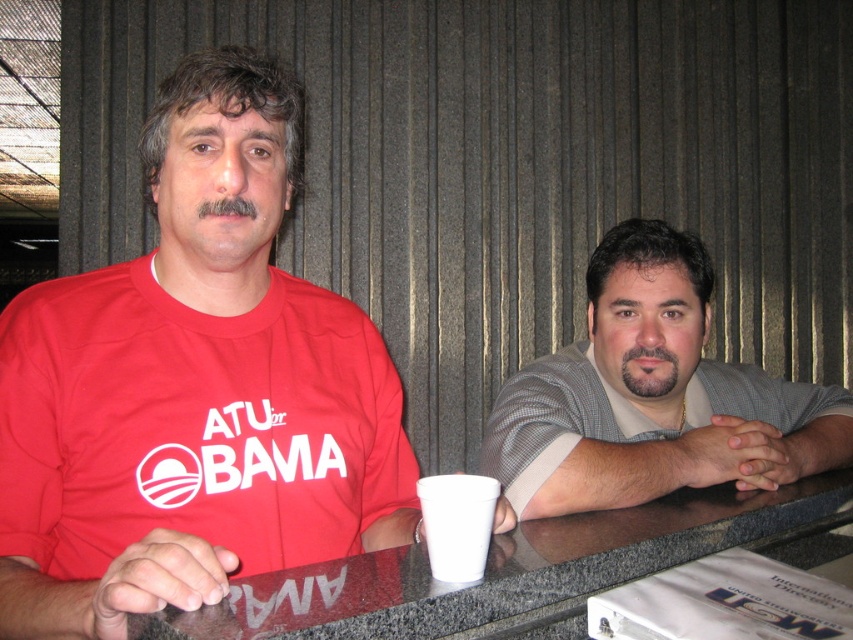
From the picture: You are a photographer standing in front of the scene. You want to take a photo of the gray textured shirt at right and the granite table at center. Which object should you focus on first to ensure it appears sharp in the photo?

The gray textured shirt at right is closer to you than the granite table at center, so you should focus on the gray textured shirt at right first to ensure it appears sharp in the photo.